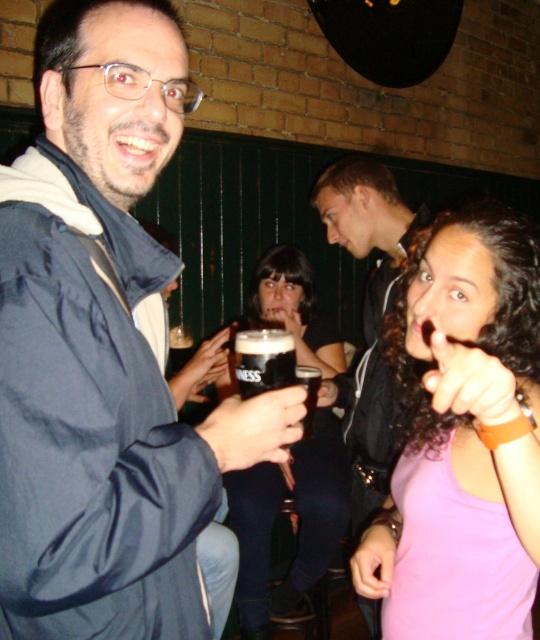
Is blue nylon jacket at center shorter than pink matte tank top at center?

In fact, blue nylon jacket at center may be taller than pink matte tank top at center.

Consider the image. Is blue nylon jacket at center below pink matte tank top at center?

No, blue nylon jacket at center is not below pink matte tank top at center.

Is point (91, 225) closer to viewer compared to point (422, 336)?

Yes, point (91, 225) is closer to viewer.

Where is `blue nylon jacket at center`? This screenshot has height=640, width=540. blue nylon jacket at center is located at coordinates (104, 349).

Is pink matte tank top at center closer to the viewer compared to black leather jacket at upper center?

Answer: Yes, it is in front of black leather jacket at upper center.

Which is in front, point (392, 340) or point (368, 419)?

Point (392, 340) is in front.

The height and width of the screenshot is (640, 540). Identify the location of pink matte tank top at center. (462, 436).

Is black leather jacket at upper center taller than black glass beer at center?

Correct, black leather jacket at upper center is much taller as black glass beer at center.

The height and width of the screenshot is (640, 540). What are the coordinates of `black leather jacket at upper center` in the screenshot? It's located at (367, 314).

Identify the location of black leather jacket at upper center. This screenshot has height=640, width=540. (367, 314).